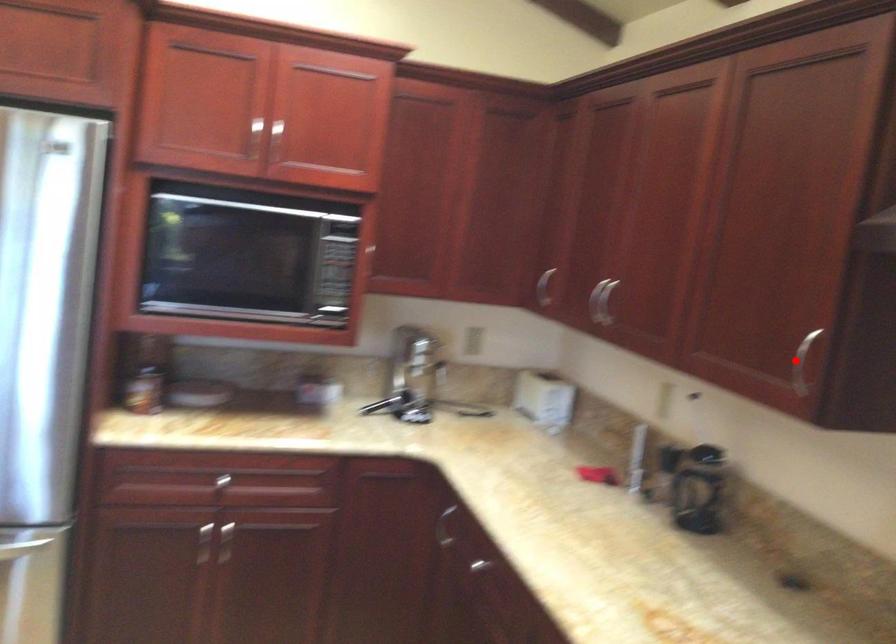
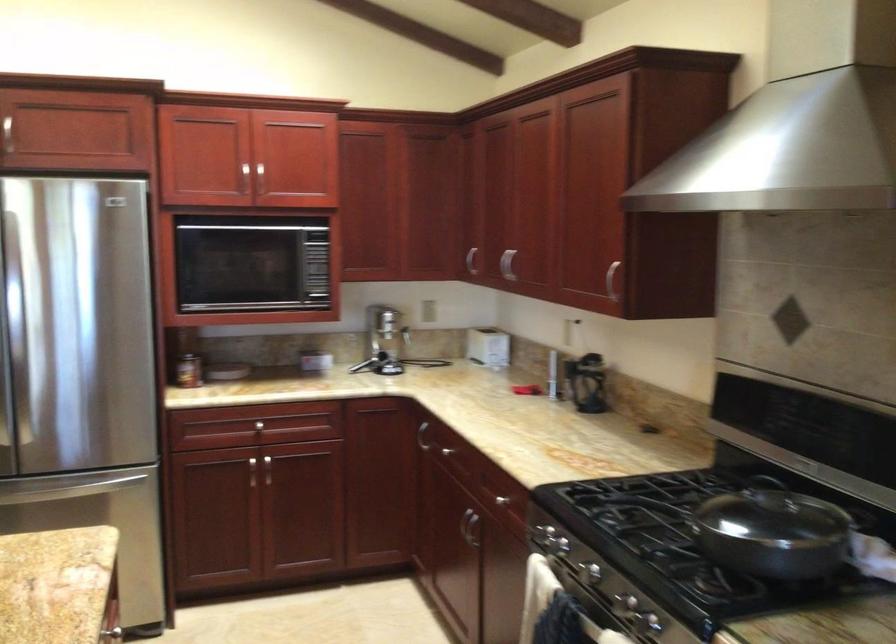
Where in the second image is the point corresponding to the highlighted location from the first image?

(612, 279)